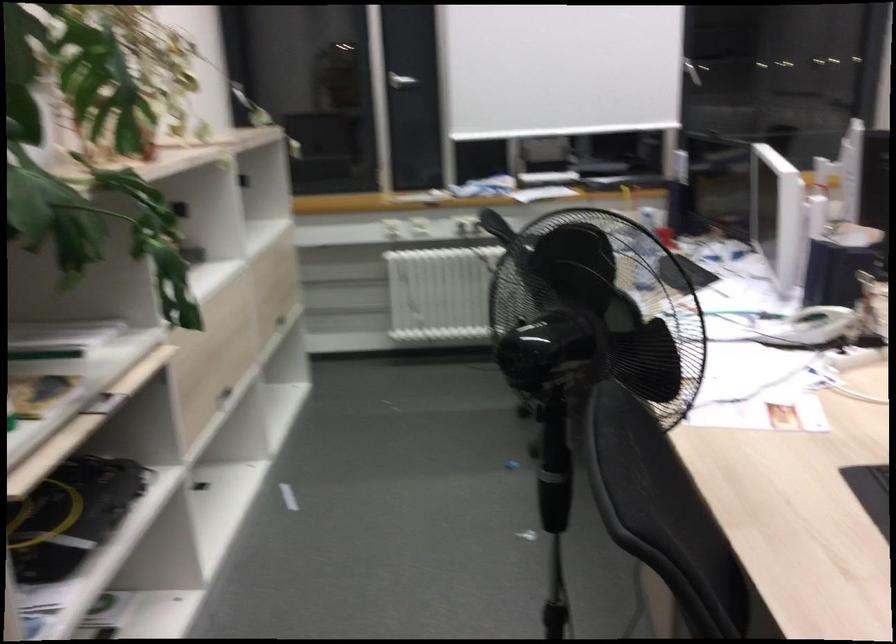
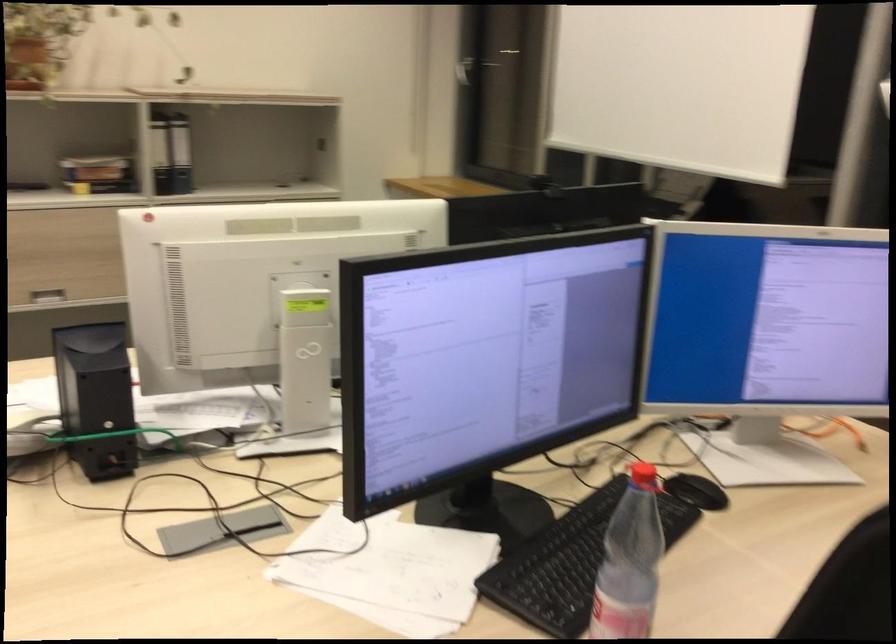
The point at (x=188, y=251) is marked in the first image. Where is the corresponding point in the second image?

(105, 175)